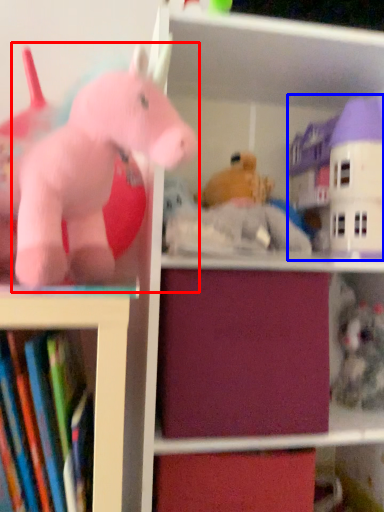
Question: Which object is closer to the camera taking this photo, toy (highlighted by a red box) or toy (highlighted by a blue box)?

Choices:
 (A) toy
 (B) toy

Answer: (A)